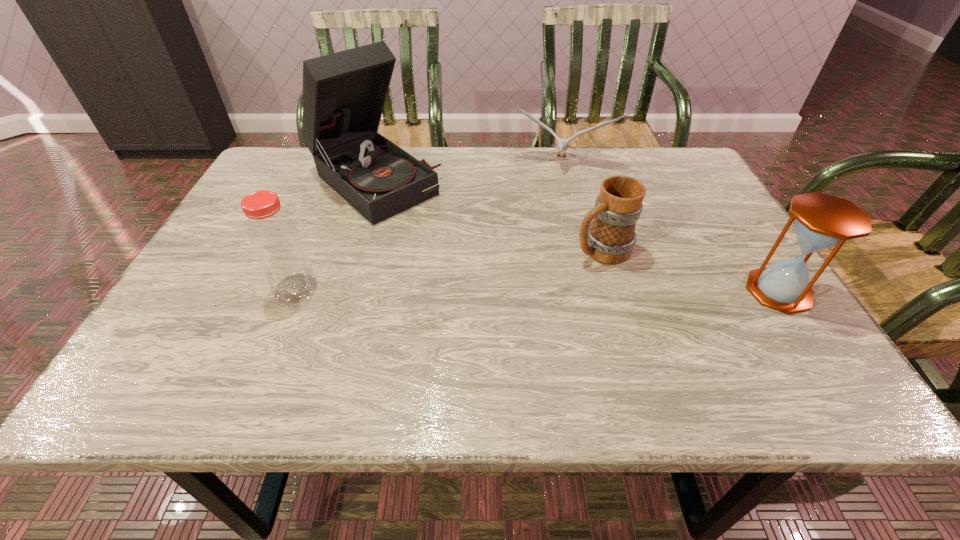
Find the location of a particular element. free space in the image that satisfies the following two spatial constraints: 1. on the back side of the bottle; 2. on the right side of the third nearest object is located at coordinates (311, 249).

Image resolution: width=960 pixels, height=540 pixels. I want to click on free point that satisfies the following two spatial constraints: 1. on the back side of the gull; 2. on the left side of the tallest object, so click(x=379, y=163).

Find the location of a particular element. vacant space that satisfies the following two spatial constraints: 1. on the front side of the mug; 2. on the left side of the tallest object is located at coordinates (352, 249).

Locate an element on the screen. The height and width of the screenshot is (540, 960). free space that satisfies the following two spatial constraints: 1. on the front side of the phonograph_record; 2. on the left side of the third farthest object is located at coordinates coord(352,249).

Locate an element on the screen. This screenshot has width=960, height=540. free space that satisfies the following two spatial constraints: 1. on the front side of the hourglass; 2. on the left side of the mug is located at coordinates (613, 291).